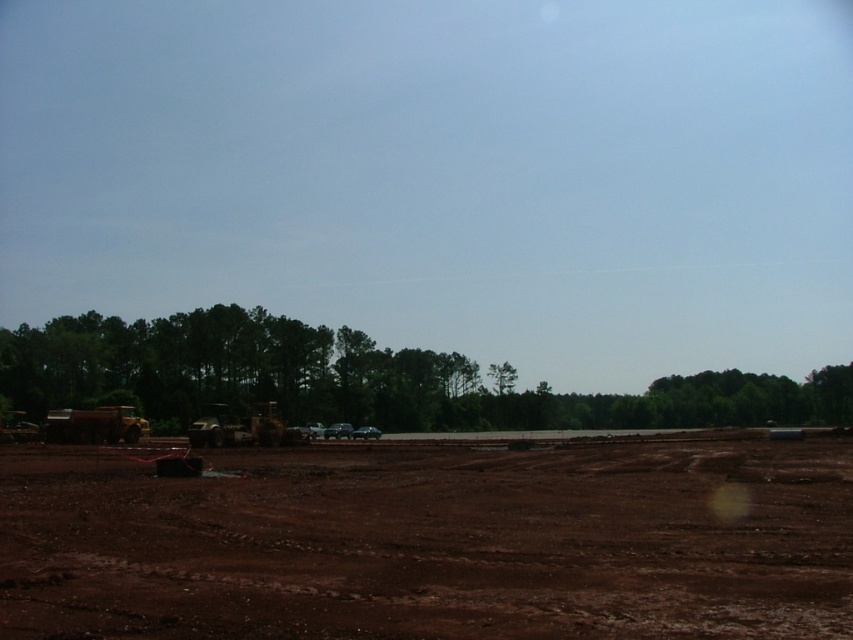
Question: Is brown dirt field at center positioned at the back of green leafy tree at center?

Choices:
 (A) yes
 (B) no

Answer: (B)

Question: Which of these objects is positioned farthest from the green leafy tree at center?

Choices:
 (A) brown dirt field at center
 (B) green leafy trees at center

Answer: (A)

Question: Which object is positioned closest to the brown dirt field at center?

Choices:
 (A) green leafy trees at center
 (B) green leafy tree at center

Answer: (A)

Question: Among these objects, which one is nearest to the camera?

Choices:
 (A) green leafy trees at center
 (B) green leafy tree at center

Answer: (A)

Question: Can you confirm if green leafy trees at center is wider than green leafy tree at center?

Choices:
 (A) yes
 (B) no

Answer: (A)

Question: Is brown dirt field at center above green leafy trees at center?

Choices:
 (A) yes
 (B) no

Answer: (A)